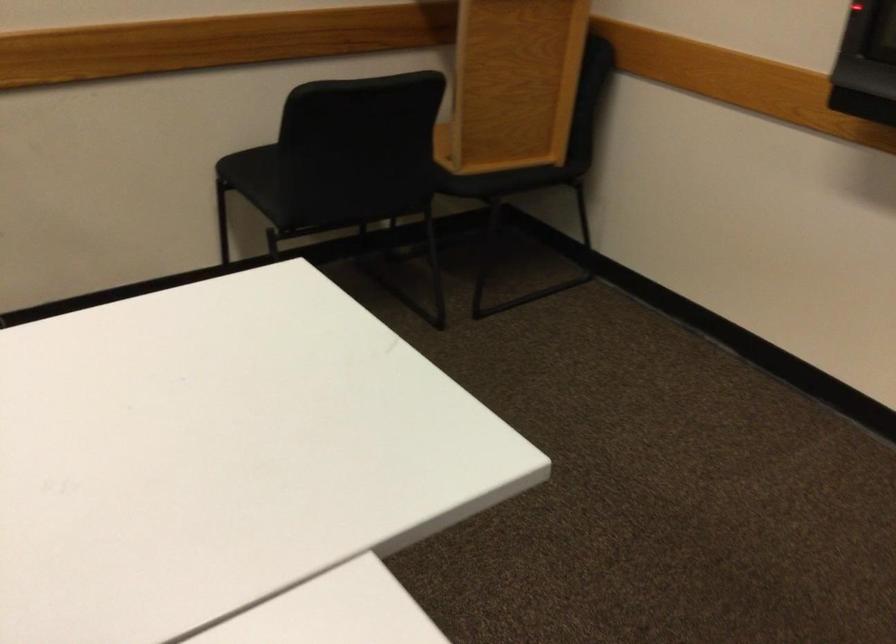
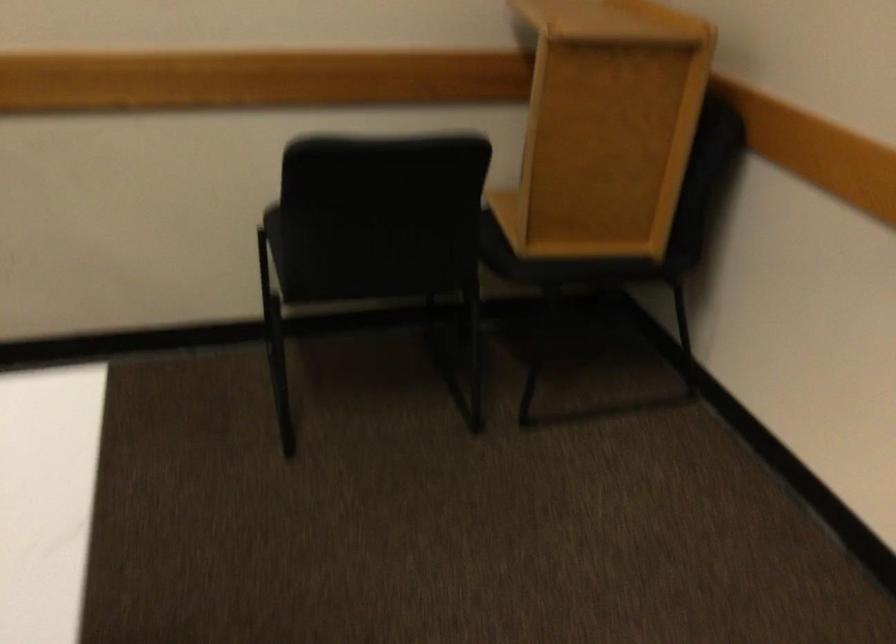
Where in the second image is the point corresponding to pixel 513 174 from the first image?

(586, 263)